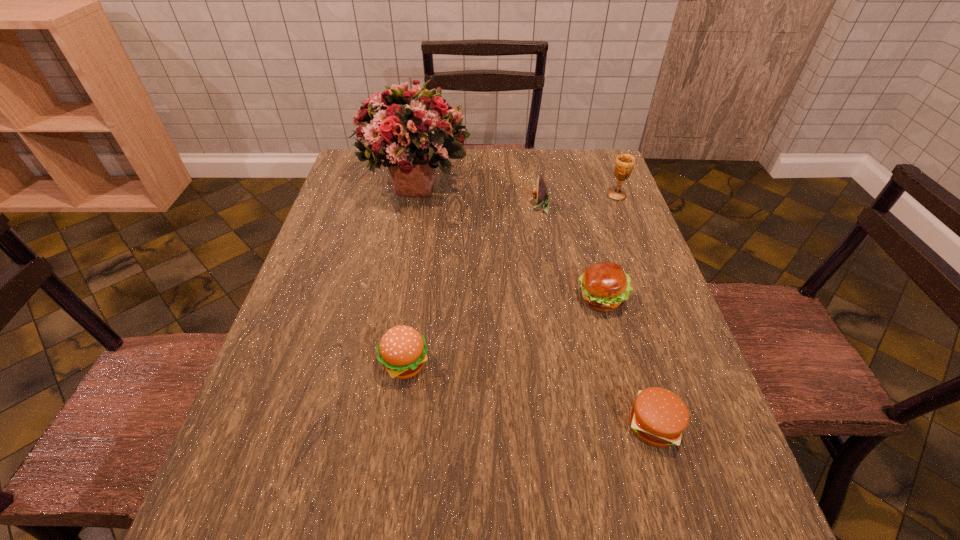
You are a GUI agent. You are given a task and a screenshot of the screen. Output one action in this format:
    pyautogui.click(x=<x>, y=<y>)
    Task: Click on the tallest object
    
    Given the screenshot: What is the action you would take?
    pyautogui.click(x=414, y=132)

Find the location of a particular element. The image size is (960, 540). chalice is located at coordinates (624, 164).

Locate an element on the screen. Image resolution: width=960 pixels, height=540 pixels. the second tallest object is located at coordinates (624, 164).

Locate an element on the screen. Image resolution: width=960 pixels, height=540 pixels. the fourth object from right to left is located at coordinates (540, 193).

Locate an element on the screen. the leftmost hamburger is located at coordinates (402, 350).

The image size is (960, 540). What are the coordinates of `the second nearest hamburger` in the screenshot? It's located at (402, 350).

Find the location of a particular element. The width and height of the screenshot is (960, 540). the farthest hamburger is located at coordinates (605, 286).

This screenshot has width=960, height=540. I want to click on the shortest object, so click(x=658, y=417).

This screenshot has height=540, width=960. I want to click on the shortest hamburger, so click(658, 417).

At what (x,y) coordinates should I click in order to perform the action: click on free location located 0.180m on the front of the bouquet. Please return your answer as a coordinate pair (x, y). Looking at the image, I should click on (401, 261).